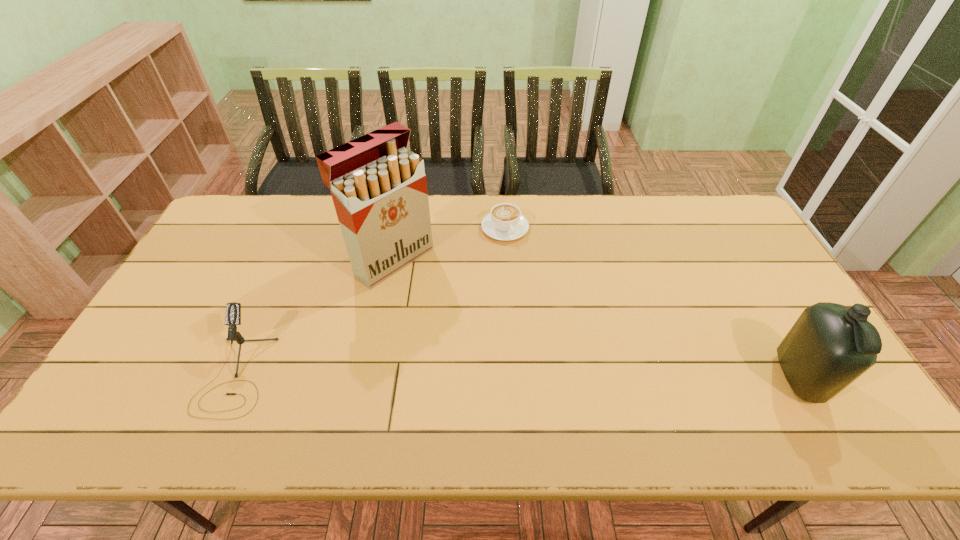
Where is `free space on the desktop that is between the leftmost object and the second tallest object and is positioned on the side of the cappuccino with the handle`? Image resolution: width=960 pixels, height=540 pixels. free space on the desktop that is between the leftmost object and the second tallest object and is positioned on the side of the cappuccino with the handle is located at coordinates (580, 376).

Locate an element on the screen. vacant spot on the desktop that is between the leftmost object and the bottle and is positioned with the lid open on the tallest object is located at coordinates (543, 376).